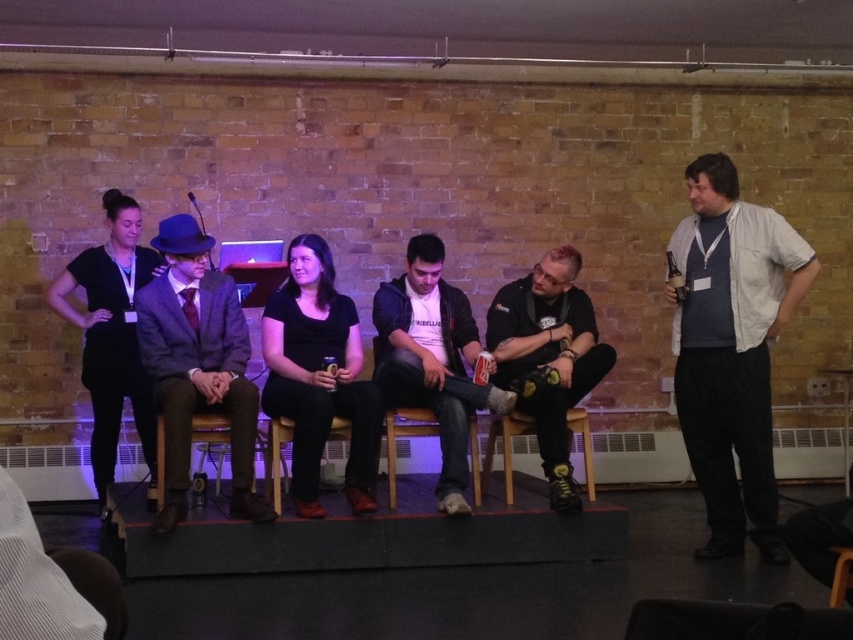
Who is higher up, black leather jacket at center or wooden chair at center?

black leather jacket at center is higher up.

Is point (558, 413) less distant than point (387, 476)?

Yes.

Find the location of a particular element. This screenshot has width=853, height=640. black leather jacket at center is located at coordinates (548, 356).

Is matte blue suit at center shorter than wooden chair at center?

In fact, matte blue suit at center may be taller than wooden chair at center.

Who is lower down, matte blue suit at center or wooden chair at center?

wooden chair at center

Which is in front, point (160, 241) or point (402, 413)?

Point (160, 241) is in front.

Find the location of a particular element. Image resolution: width=853 pixels, height=640 pixels. matte blue suit at center is located at coordinates (196, 365).

Which is in front, point (531, 358) or point (833, 548)?

Point (833, 548)

Can you confirm if black leather jacket at center is positioned to the left of wooden chair at lower right?

Correct, you'll find black leather jacket at center to the left of wooden chair at lower right.

Which is behind, point (538, 419) or point (833, 595)?

Positioned behind is point (538, 419).

Locate an element on the screen. This screenshot has height=640, width=853. black leather jacket at center is located at coordinates (548, 356).